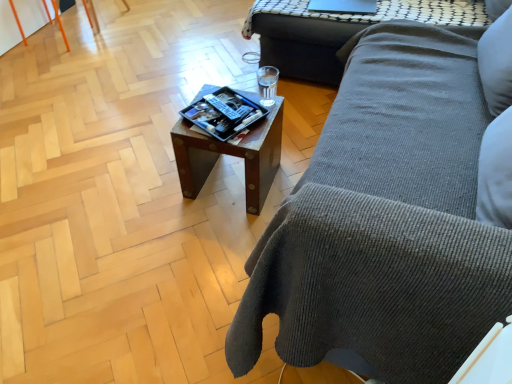
In order to click on unoccupied area in front of orange plastic chair at upper left in this screenshot , I will do `click(48, 66)`.